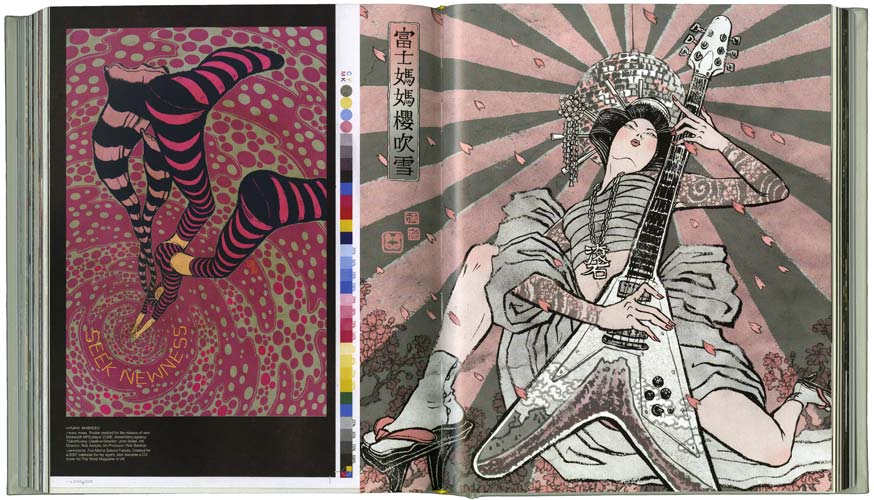
Image resolution: width=874 pixels, height=500 pixels. Find the location of `book`. book is located at coordinates (441, 23).